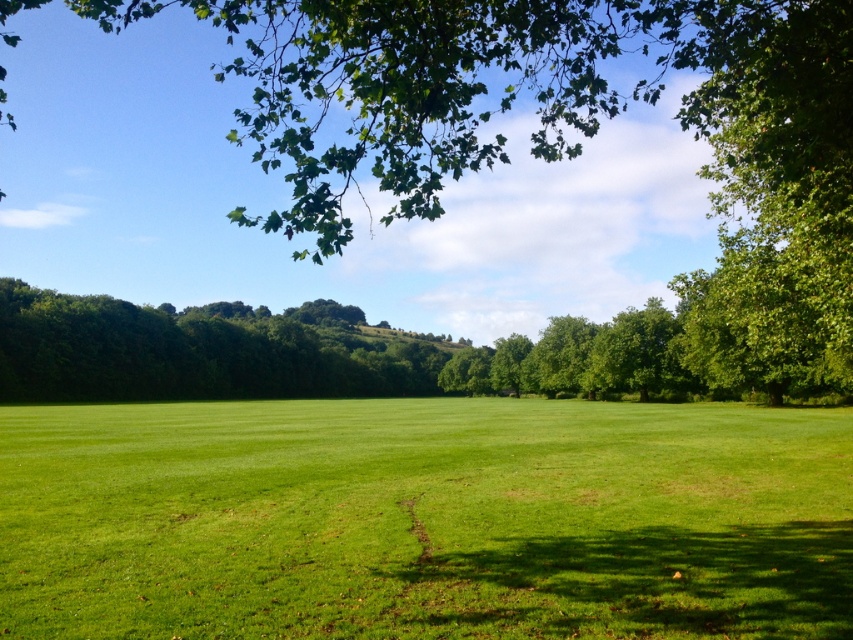
Question: Which point is closer to the camera?

Choices:
 (A) green leafy tree at upper center
 (B) green grass at center

Answer: (B)

Question: Among these objects, which one is farthest from the camera?

Choices:
 (A) green grass at center
 (B) green leafy tree at upper center

Answer: (B)

Question: Does green grass at center appear under green leafy tree at upper center?

Choices:
 (A) no
 (B) yes

Answer: (B)

Question: Is green grass at center to the left of green leafy tree at upper center from the viewer's perspective?

Choices:
 (A) yes
 (B) no

Answer: (B)

Question: Which of the following is the farthest from the observer?

Choices:
 (A) green grass at center
 (B) green leafy tree at upper center

Answer: (B)

Question: Can you confirm if green grass at center is positioned to the right of green leafy tree at upper center?

Choices:
 (A) yes
 (B) no

Answer: (A)